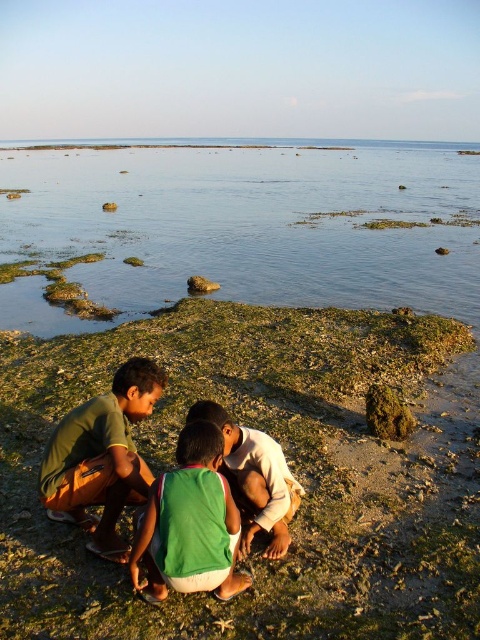
Question: Which object appears closest to the camera in this image?

Choices:
 (A) brown rough rock at center
 (B) green fabric shirt at center
 (C) green jersey at center

Answer: (C)

Question: Can you confirm if clear water at center is positioned below green jersey at center?

Choices:
 (A) yes
 (B) no

Answer: (B)

Question: Does green cotton shirt at lower left appear under green fabric shirt at center?

Choices:
 (A) no
 (B) yes

Answer: (A)

Question: Which point appears closest to the camera in this image?

Choices:
 (A) (477, 262)
 (B) (233, 486)

Answer: (B)

Question: Which of these objects is positioned farthest from the clear water at center?

Choices:
 (A) brown rough rock at center
 (B) green fabric shirt at center
 (C) green jersey at center
 (D) green cotton shirt at lower left

Answer: (A)

Question: Where is green cotton shirt at lower left located in relation to green jersey at center in the image?

Choices:
 (A) above
 (B) below

Answer: (A)